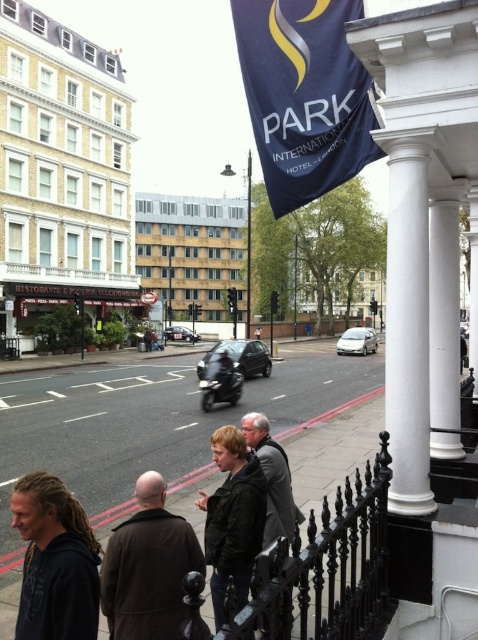
You are standing at the center of the sidewalk and want to approach the brown leather coat at lower left. Which direction should you move in to get closer to it?

The brown leather coat at lower left is located at point [148,566], so you should move to the left and slightly forward to reach it.

You are a pedestrian on the sidewalk and want to cross the street to the building with the sign. The dark blue fabric flag at upper center and the dark brown hair at lower left are in your line of sight. Which object will you look up to see first?

The dark blue fabric flag at upper center is above dark brown hair at lower left, so you will see the dark blue fabric flag at upper center first when looking up.